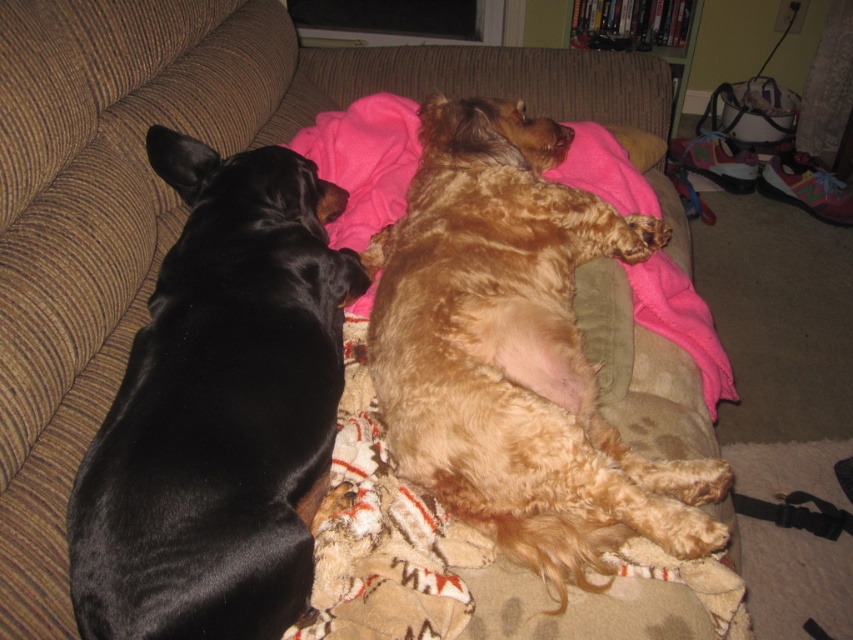
Question: Is black smooth dog at left above golden fur dog at center?

Choices:
 (A) yes
 (B) no

Answer: (B)

Question: Which object is positioned farthest from the black smooth dog at left?

Choices:
 (A) golden fur dog at center
 (B) fluffy beige blanket at center

Answer: (A)

Question: Can you confirm if black smooth dog at left is bigger than fluffy beige blanket at center?

Choices:
 (A) no
 (B) yes

Answer: (B)

Question: Considering the real-world distances, which object is farthest from the fluffy beige blanket at center?

Choices:
 (A) black smooth dog at left
 (B) golden fur dog at center

Answer: (A)

Question: Which point appears farthest from the camera in this image?

Choices:
 (A) (587, 426)
 (B) (354, 422)
 (C) (219, 317)

Answer: (B)

Question: Is black smooth dog at left to the left of fluffy beige blanket at center from the viewer's perspective?

Choices:
 (A) yes
 (B) no

Answer: (A)